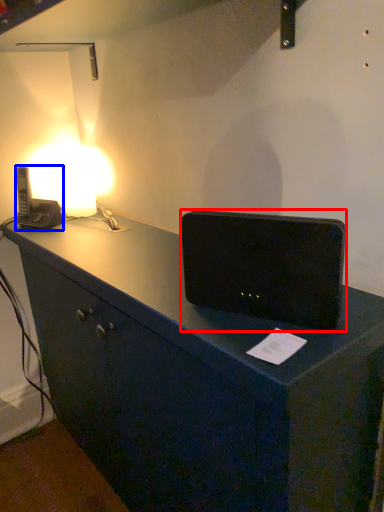
Question: Among these objects, which one is nearest to the camera, loudspeaker (highlighted by a red box) or gadget (highlighted by a blue box)?

Choices:
 (A) loudspeaker
 (B) gadget

Answer: (A)